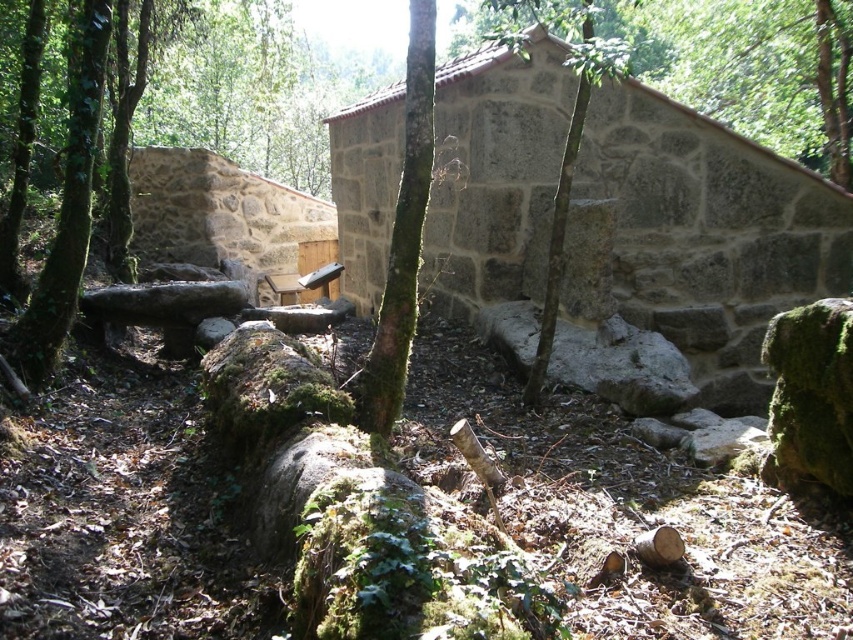
Question: Is rustic stone cabin at center wider than green mossy tree at center?

Choices:
 (A) no
 (B) yes

Answer: (A)

Question: Which point appears farthest from the camera in this image?

Choices:
 (A) (410, 109)
 (B) (68, 176)

Answer: (B)

Question: Which object is closer to the camera taking this photo?

Choices:
 (A) green mossy tree trunk at left
 (B) rustic stone cabin at center
 (C) stone cabin at center

Answer: (A)

Question: Is stone cabin at center to the left of green mossy tree at center from the viewer's perspective?

Choices:
 (A) yes
 (B) no

Answer: (A)

Question: Can you confirm if rustic stone cabin at center is smaller than green mossy bark tree trunk at center?

Choices:
 (A) no
 (B) yes

Answer: (A)

Question: Which of the following is the farthest from the observer?

Choices:
 (A) (392, 298)
 (B) (805, 252)
 (C) (560, 176)

Answer: (B)